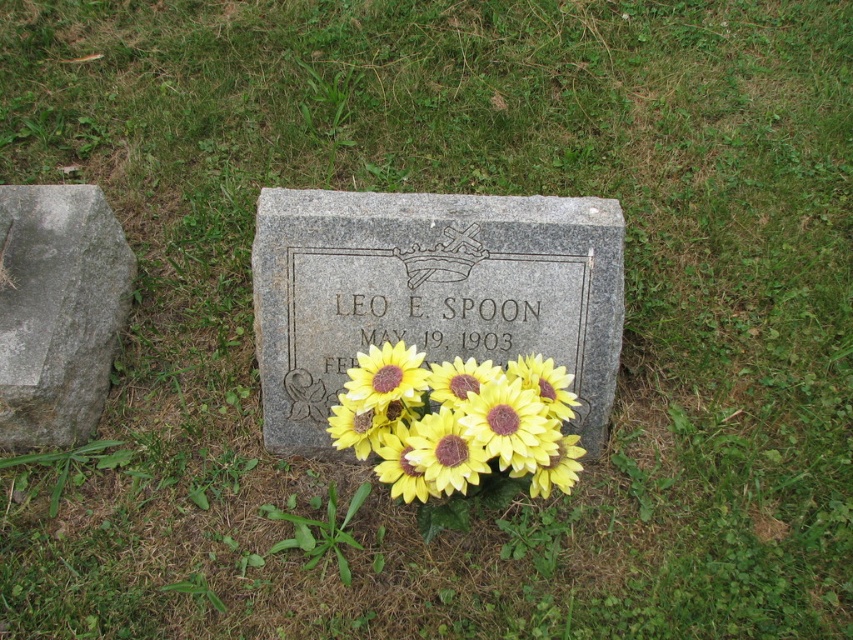
Between granite gravestone at center and gray rough stone at left, which one appears on the left side from the viewer's perspective?

A: gray rough stone at left is more to the left.

Can you confirm if granite gravestone at center is wider than gray rough stone at left?

Correct, the width of granite gravestone at center exceeds that of gray rough stone at left.

Between point (509, 308) and point (107, 320), which one is positioned behind?

Positioned behind is point (107, 320).

Locate an element on the screen. granite gravestone at center is located at coordinates (430, 294).

Which is below, granite gravestone at center or yellow matte sunflower at center?

Positioned lower is yellow matte sunflower at center.

Is granite gravestone at center above yellow matte sunflower at center?

Indeed, granite gravestone at center is positioned over yellow matte sunflower at center.

This screenshot has width=853, height=640. I want to click on granite gravestone at center, so click(x=430, y=294).

This screenshot has width=853, height=640. I want to click on granite gravestone at center, so click(x=430, y=294).

Can you confirm if gray rough stone at left is thinner than yellow matte sunflower at center?

Indeed, gray rough stone at left has a lesser width compared to yellow matte sunflower at center.

Between point (9, 230) and point (544, 369), which one is positioned behind?

The point (9, 230) is more distant.

Is point (49, 243) positioned behind point (425, 476)?

Yes, point (49, 243) is farther from viewer.

Where is `gray rough stone at left`? Image resolution: width=853 pixels, height=640 pixels. gray rough stone at left is located at coordinates (57, 310).